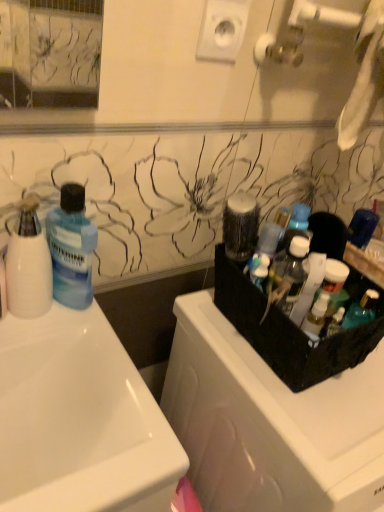
Locate an element on the screen. This screenshot has width=384, height=512. vacant area that lies to the right of white matte cup at left, the 1th cleaning product in the left-to-right sequence is located at coordinates (96, 351).